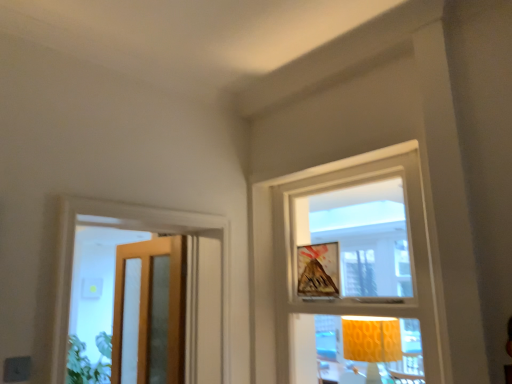
Where is `white textured frame at upper center, which is the 2th window from left to right`? The height and width of the screenshot is (384, 512). white textured frame at upper center, which is the 2th window from left to right is located at coordinates (354, 275).

This screenshot has width=512, height=384. What do you see at coordinates (318, 270) in the screenshot?
I see `matte wooden picture frame at upper center` at bounding box center [318, 270].

What is the approximate width of wooden glass door at left?

It is 5.07 inches.

What do you see at coordinates (151, 311) in the screenshot?
I see `wooden glass door at left` at bounding box center [151, 311].

I want to click on white textured frame at upper center, the first window positioned from the right, so pyautogui.click(x=354, y=275).

Which of these two, matte wooden picture frame at upper center or matte yellow fabric lampshade at center, stands taller?

matte yellow fabric lampshade at center is taller.

Is matte wooden picture frame at upper center oriented away from matte yellow fabric lampshade at center?

No.

Could you measure the distance between matte wooden picture frame at upper center and matte yellow fabric lampshade at center?

matte wooden picture frame at upper center is 2.33 meters away from matte yellow fabric lampshade at center.

Choose the correct answer: Is matte yellow fabric lampshade at center inside white textured frame at upper center, the first window positioned from the right, or outside it?

matte yellow fabric lampshade at center fits inside white textured frame at upper center, the first window positioned from the right.

Is matte yellow fabric lampshade at center looking in the opposite direction of white textured frame at upper center, which is the 2th window from left to right?

Yes, white textured frame at upper center, which is the 2th window from left to right, is at the back of matte yellow fabric lampshade at center.

From the image's perspective, is matte yellow fabric lampshade at center over white textured frame at upper center, which is the 2th window from left to right?

No, from the image's perspective, matte yellow fabric lampshade at center is not above white textured frame at upper center, which is the 2th window from left to right.

From the image's perspective, is wooden glass door at left under white textured frame at upper center, the first window positioned from the right?

Yes, from the image's perspective, wooden glass door at left is below white textured frame at upper center, the first window positioned from the right.

Is wooden glass door at left taller than white textured frame at upper center, the first window positioned from the right?

In fact, wooden glass door at left may be shorter than white textured frame at upper center, the first window positioned from the right.

Is white textured frame at upper center, which is the 2th window from left to right, inside matte wooden picture frame at upper center?

No, white textured frame at upper center, which is the 2th window from left to right, is not inside matte wooden picture frame at upper center.

Considering the sizes of matte wooden picture frame at upper center and white textured frame at upper center, the first window positioned from the right, in the image, is matte wooden picture frame at upper center bigger or smaller than white textured frame at upper center, the first window positioned from the right,?

Considering their sizes, matte wooden picture frame at upper center takes up less space than white textured frame at upper center, the first window positioned from the right.

Considering the positions of points (339, 270) and (300, 204), is point (339, 270) closer to camera compared to point (300, 204)?

Yes.

This screenshot has height=384, width=512. What are the coordinates of `the 2nd window in front of the matte wooden picture frame at upper center, starting your count from the anchor` in the screenshot? It's located at (354, 275).

Could you measure the distance between clear glass door at left, arranged as the 2th window when viewed from the right, and wooden glass door at left?

clear glass door at left, arranged as the 2th window when viewed from the right, and wooden glass door at left are 23.82 inches apart from each other.

From the picture: Is the depth of clear glass door at left, arranged as the 2th window when viewed from the right, greater than that of wooden glass door at left?

No, the depth of clear glass door at left, arranged as the 2th window when viewed from the right, is less than that of wooden glass door at left.

How many degrees apart are the facing directions of clear glass door at left, arranged as the 2th window when viewed from the right, and wooden glass door at left?

The angle between the facing direction of clear glass door at left, arranged as the 2th window when viewed from the right, and the facing direction of wooden glass door at left is 90 degrees.

From a real-world perspective, is clear glass door at left, arranged as the 2th window when viewed from the right, over wooden glass door at left?

Indeed, from a real-world perspective, clear glass door at left, arranged as the 2th window when viewed from the right, stands above wooden glass door at left.

Which is behind, point (147, 309) or point (300, 274)?

Positioned behind is point (147, 309).

Is the surface of wooden glass door at left in direct contact with matte wooden picture frame at upper center?

No.

Which is behind, wooden glass door at left or matte wooden picture frame at upper center?

Positioned behind is wooden glass door at left.

Is white textured frame at upper center, which is the 2th window from left to right, at the right side of wooden glass door at left?

Yes.

Which of these two, white textured frame at upper center, the first window positioned from the right, or wooden glass door at left, is bigger?

Bigger between the two is white textured frame at upper center, the first window positioned from the right.

Considering the positions of objects white textured frame at upper center, the first window positioned from the right, and wooden glass door at left in the image provided, who is behind, white textured frame at upper center, the first window positioned from the right, or wooden glass door at left?

wooden glass door at left is further away from the camera.

From the wooden glass door at left, count 2nd window to the right and point to it. Please provide its 2D coordinates.

[(354, 275)]

This screenshot has height=384, width=512. Find the location of `table lamp on the right of matte wooden picture frame at upper center`. table lamp on the right of matte wooden picture frame at upper center is located at coordinates point(371,342).

This screenshot has height=384, width=512. Find the location of `table lamp directly beneath the white textured frame at upper center, which is the 2th window from left to right (from a real-world perspective)`. table lamp directly beneath the white textured frame at upper center, which is the 2th window from left to right (from a real-world perspective) is located at coordinates (371, 342).

Based on their spatial positions, is wooden glass door at left or matte yellow fabric lampshade at center closer to matte wooden picture frame at upper center?

wooden glass door at left is positioned closer to the anchor matte wooden picture frame at upper center.

Looking at the image, which one is located further to matte wooden picture frame at upper center, clear glass door at left, which ranks as the 1th window in left-to-right order, or wooden glass door at left?

wooden glass door at left lies further to matte wooden picture frame at upper center than the other object.

Consider the image. Looking at the image, which one is located closer to clear glass door at left, arranged as the 2th window when viewed from the right, matte yellow fabric lampshade at center or white textured frame at upper center, the first window positioned from the right?

Based on the image, matte yellow fabric lampshade at center appears to be nearer to clear glass door at left, arranged as the 2th window when viewed from the right.

Based on their spatial positions, is clear glass door at left, which ranks as the 1th window in left-to-right order, or wooden glass door at left further from white textured frame at upper center, the first window positioned from the right?

clear glass door at left, which ranks as the 1th window in left-to-right order, is further to white textured frame at upper center, the first window positioned from the right.

Based on their spatial positions, is matte yellow fabric lampshade at center or clear glass door at left, arranged as the 2th window when viewed from the right, further from wooden glass door at left?

Based on the image, matte yellow fabric lampshade at center appears to be further to wooden glass door at left.

Which object lies further to the anchor point matte wooden picture frame at upper center, white textured frame at upper center, which is the 2th window from left to right, or wooden glass door at left?

Among the two, white textured frame at upper center, which is the 2th window from left to right, is located further to matte wooden picture frame at upper center.

Looking at the image, which one is located closer to clear glass door at left, which ranks as the 1th window in left-to-right order, wooden glass door at left or matte yellow fabric lampshade at center?

Among the two, wooden glass door at left is located nearer to clear glass door at left, which ranks as the 1th window in left-to-right order.

Based on their spatial positions, is wooden glass door at left or clear glass door at left, arranged as the 2th window when viewed from the right, further from matte wooden picture frame at upper center?

wooden glass door at left is positioned further to the anchor matte wooden picture frame at upper center.

Where is `window between wooden glass door at left and white textured frame at upper center, the first window positioned from the right, from left to right`? window between wooden glass door at left and white textured frame at upper center, the first window positioned from the right, from left to right is located at coordinates (126, 227).

Where is `window situated between wooden glass door at left and matte wooden picture frame at upper center from left to right`? The height and width of the screenshot is (384, 512). window situated between wooden glass door at left and matte wooden picture frame at upper center from left to right is located at coordinates (126, 227).

Where is `window located between clear glass door at left, arranged as the 2th window when viewed from the right, and matte yellow fabric lampshade at center in the left-right direction`? window located between clear glass door at left, arranged as the 2th window when viewed from the right, and matte yellow fabric lampshade at center in the left-right direction is located at coordinates (354, 275).

Where is `picture frame located between wooden glass door at left and matte yellow fabric lampshade at center in the left-right direction`? picture frame located between wooden glass door at left and matte yellow fabric lampshade at center in the left-right direction is located at coordinates (318, 270).